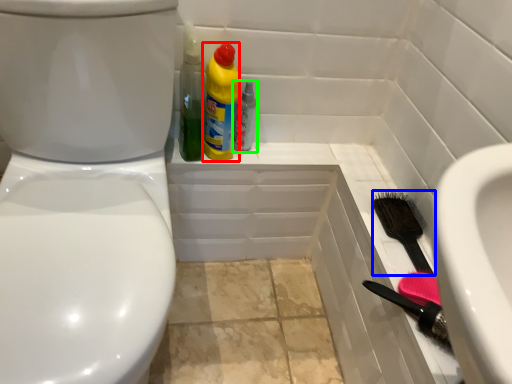
Question: Which object is positioned closest to cleaning product (highlighted by a red box)? Select from brush (highlighted by a blue box) and bottle (highlighted by a green box).

Choices:
 (A) brush
 (B) bottle

Answer: (B)